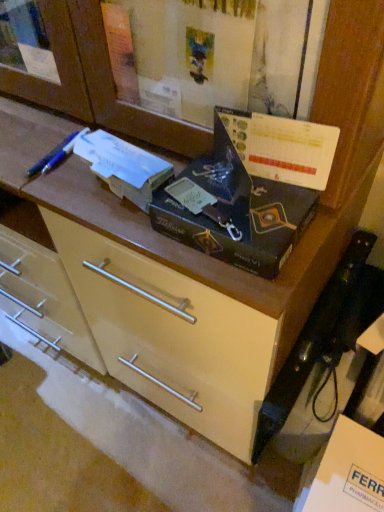
Question: Would you say white cardboard box at lower right is a long distance from blue plastic pen at upper left?

Choices:
 (A) yes
 (B) no

Answer: (B)

Question: Is white cardboard box at lower right smaller than blue plastic pen at upper left?

Choices:
 (A) no
 (B) yes

Answer: (A)

Question: Considering the relative sizes of white cardboard box at lower right and blue plastic pen at upper left in the image provided, is white cardboard box at lower right shorter than blue plastic pen at upper left?

Choices:
 (A) yes
 (B) no

Answer: (B)

Question: Is white cardboard box at lower right positioned with its back to blue plastic pen at upper left?

Choices:
 (A) yes
 (B) no

Answer: (B)

Question: Is white cardboard box at lower right to the left of blue plastic pen at upper left from the viewer's perspective?

Choices:
 (A) no
 (B) yes

Answer: (A)

Question: From a real-world perspective, is white cardboard box at lower right on top of blue plastic pen at upper left?

Choices:
 (A) yes
 (B) no

Answer: (B)

Question: Is blue plastic pen at upper left looking in the opposite direction of matte cream drawer at center?

Choices:
 (A) no
 (B) yes

Answer: (A)

Question: Considering the relative positions of blue plastic pen at upper left and matte cream drawer at center in the image provided, is blue plastic pen at upper left behind matte cream drawer at center?

Choices:
 (A) yes
 (B) no

Answer: (B)

Question: Is blue plastic pen at upper left beside matte cream drawer at center?

Choices:
 (A) yes
 (B) no

Answer: (B)

Question: Is blue plastic pen at upper left bigger than matte cream drawer at center?

Choices:
 (A) no
 (B) yes

Answer: (A)

Question: Considering the relative sizes of blue plastic pen at upper left and matte cream drawer at center in the image provided, is blue plastic pen at upper left smaller than matte cream drawer at center?

Choices:
 (A) yes
 (B) no

Answer: (A)

Question: Is blue plastic pen at upper left shorter than matte cream drawer at center?

Choices:
 (A) yes
 (B) no

Answer: (A)

Question: From a real-world perspective, is blue plastic pen at upper left below matte black box at center?

Choices:
 (A) yes
 (B) no

Answer: (A)